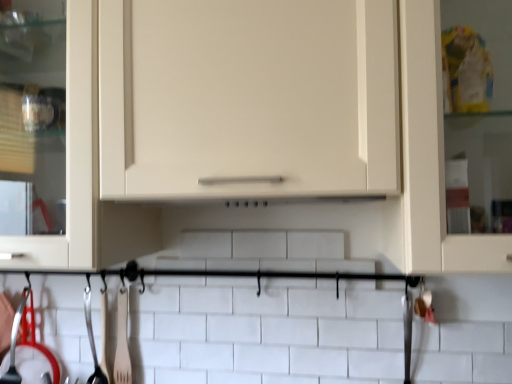
Question: Is matte white cabinet at center inside polished metal ladle at lower left, the 1th silverware from the left?

Choices:
 (A) yes
 (B) no

Answer: (B)

Question: Does polished metal ladle at lower left, the 1th silverware from the left, have a lesser height compared to matte white cabinet at center?

Choices:
 (A) no
 (B) yes

Answer: (B)

Question: Is polished metal ladle at lower left, positioned as the fourth silverware in right-to-left order, positioned before matte white cabinet at center?

Choices:
 (A) yes
 (B) no

Answer: (B)

Question: Can you confirm if polished metal ladle at lower left, positioned as the fourth silverware in right-to-left order, is taller than matte white cabinet at center?

Choices:
 (A) yes
 (B) no

Answer: (B)

Question: Is polished metal ladle at lower left, the 1th silverware from the left, oriented towards matte white cabinet at center?

Choices:
 (A) yes
 (B) no

Answer: (B)

Question: Considering the relative sizes of polished metal ladle at lower left, the 1th silverware from the left, and matte white cabinet at center in the image provided, is polished metal ladle at lower left, the 1th silverware from the left, smaller than matte white cabinet at center?

Choices:
 (A) no
 (B) yes

Answer: (B)

Question: From a real-world perspective, is matte white cabinet at center on polished metal spatula at lower left, which is counted as the 2th silverware, starting from the right?

Choices:
 (A) yes
 (B) no

Answer: (A)

Question: Can you confirm if matte white cabinet at center is shorter than polished metal spatula at lower left, which is counted as the 2th silverware, starting from the right?

Choices:
 (A) yes
 (B) no

Answer: (B)

Question: Does matte white cabinet at center have a greater height compared to polished metal spatula at lower left, which is counted as the 2th silverware, starting from the right?

Choices:
 (A) no
 (B) yes

Answer: (B)

Question: Is matte white cabinet at center closer to the viewer compared to polished metal spatula at lower left, which is counted as the 2th silverware, starting from the right?

Choices:
 (A) no
 (B) yes

Answer: (B)

Question: Is the surface of matte white cabinet at center in direct contact with polished metal spatula at lower left, which is counted as the 2th silverware, starting from the right?

Choices:
 (A) yes
 (B) no

Answer: (B)

Question: Is matte white cabinet at center not near polished metal spatula at lower left, positioned as the 3th silverware in left-to-right order?

Choices:
 (A) no
 (B) yes

Answer: (A)

Question: From a real-world perspective, is polished metal spatula at lower left, positioned as the 3th silverware in left-to-right order, located beneath polished metal ladle at lower left, positioned as the fourth silverware in right-to-left order?

Choices:
 (A) yes
 (B) no

Answer: (A)